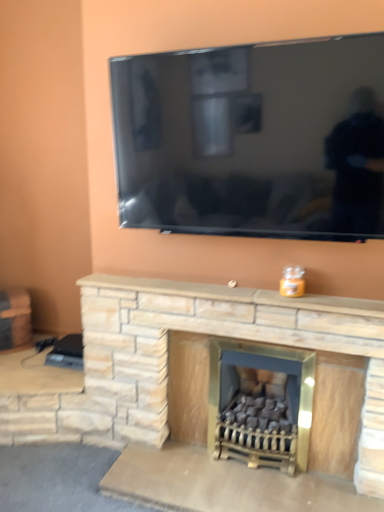
Question: Considering the relative sizes of matte stone fireplace at center, acting as the first fireplace starting from the right, and natural stone fireplace at center in the image provided, is matte stone fireplace at center, acting as the first fireplace starting from the right, bigger than natural stone fireplace at center?

Choices:
 (A) yes
 (B) no

Answer: (A)

Question: Is the depth of matte stone fireplace at center, acting as the second fireplace starting from the left, less than that of natural stone fireplace at center?

Choices:
 (A) yes
 (B) no

Answer: (B)

Question: From a real-world perspective, is matte stone fireplace at center, acting as the first fireplace starting from the right, below natural stone fireplace at center?

Choices:
 (A) yes
 (B) no

Answer: (A)

Question: Is matte stone fireplace at center, acting as the first fireplace starting from the right, wider than natural stone fireplace at center?

Choices:
 (A) no
 (B) yes

Answer: (B)

Question: Is matte stone fireplace at center, acting as the second fireplace starting from the left, thinner than natural stone fireplace at center?

Choices:
 (A) no
 (B) yes

Answer: (A)

Question: From the image's perspective, is matte stone fireplace at center, acting as the first fireplace starting from the right, located above or below brushed metal side table at left?

Choices:
 (A) above
 (B) below

Answer: (B)

Question: Does point (294, 420) appear closer or farther from the camera than point (4, 311)?

Choices:
 (A) closer
 (B) farther

Answer: (A)

Question: From a real-world perspective, is matte stone fireplace at center, acting as the first fireplace starting from the right, above or below brushed metal side table at left?

Choices:
 (A) below
 (B) above

Answer: (A)

Question: Considering the positions of matte stone fireplace at center, acting as the first fireplace starting from the right, and brushed metal side table at left in the image, is matte stone fireplace at center, acting as the first fireplace starting from the right, wider or thinner than brushed metal side table at left?

Choices:
 (A) wide
 (B) thin

Answer: (B)

Question: Considering the positions of matte stone fireplace at center, acting as the second fireplace starting from the left, and natural stone fireplace at center in the image, is matte stone fireplace at center, acting as the second fireplace starting from the left, wider or thinner than natural stone fireplace at center?

Choices:
 (A) thin
 (B) wide

Answer: (B)

Question: Is matte stone fireplace at center, acting as the first fireplace starting from the right, in front of or behind natural stone fireplace at center in the image?

Choices:
 (A) behind
 (B) front

Answer: (A)

Question: Which is correct: matte stone fireplace at center, acting as the second fireplace starting from the left, is inside natural stone fireplace at center, or outside of it?

Choices:
 (A) inside
 (B) outside

Answer: (B)

Question: From a real-world perspective, is matte stone fireplace at center, acting as the first fireplace starting from the right, above or below natural stone fireplace at center?

Choices:
 (A) above
 (B) below

Answer: (B)

Question: Visually, is natural stone fireplace at center positioned to the left or to the right of matte stone fireplace at center, acting as the second fireplace starting from the left?

Choices:
 (A) right
 (B) left

Answer: (B)

Question: In terms of width, does natural stone fireplace at center look wider or thinner when compared to matte stone fireplace at center, acting as the second fireplace starting from the left?

Choices:
 (A) wide
 (B) thin

Answer: (B)